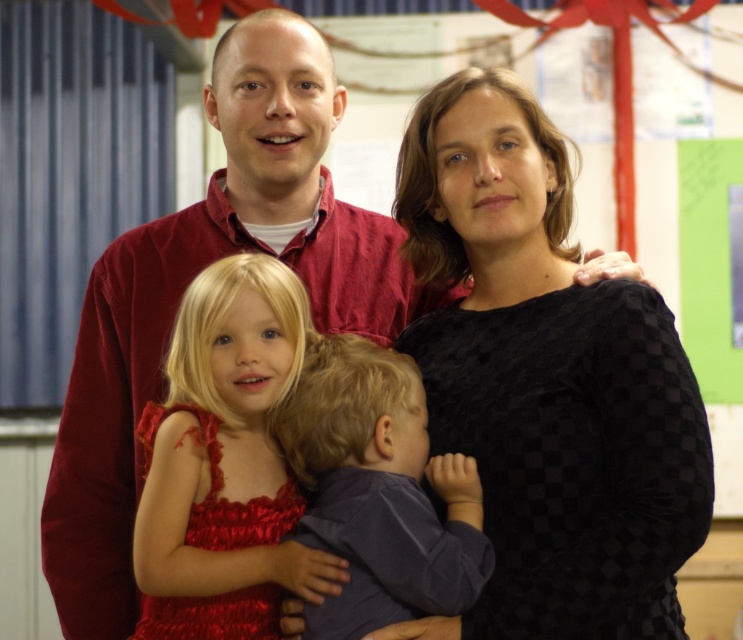
Question: Can you confirm if black checkered dress at center is positioned to the right of shiny red dress at center?

Choices:
 (A) no
 (B) yes

Answer: (B)

Question: Is black checkered dress at center to the left of matte purple shirt at center from the viewer's perspective?

Choices:
 (A) yes
 (B) no

Answer: (B)

Question: Which of the following is the closest to the observer?

Choices:
 (A) (x=262, y=493)
 (B) (x=366, y=540)

Answer: (B)

Question: Can you confirm if black checkered dress at center is positioned below shiny red dress at center?

Choices:
 (A) yes
 (B) no

Answer: (B)

Question: Which of the following is the closest to the observer?

Choices:
 (A) black checkered dress at center
 (B) matte purple shirt at center

Answer: (A)

Question: Among these points, which one is farthest from the camera?

Choices:
 (A) (220, 365)
 (B) (421, 508)

Answer: (A)